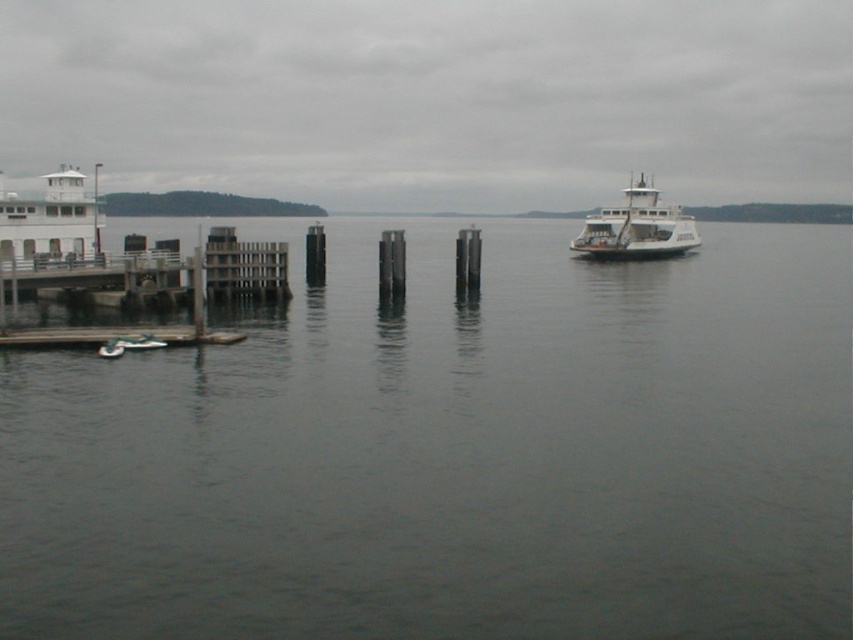
Looking at this image, is gray water at center shorter than white matte ferry at right?

Incorrect, gray water at center's height does not fall short of white matte ferry at right's.

Is gray water at center positioned in front of white matte ferry at right?

That is True.

Who is more forward, (332, 547) or (576, 236)?

Point (332, 547) is in front.

Find the location of a particular element. gray water at center is located at coordinates (454, 452).

Which is in front, point (466, 534) or point (286, 122)?

Positioned in front is point (466, 534).

Does gray water at center have a lesser height compared to white matte ferry at center?

Yes, gray water at center is shorter than white matte ferry at center.

Where is `gray water at center`? This screenshot has height=640, width=853. gray water at center is located at coordinates (454, 452).

In order to click on gray water at center in this screenshot , I will do `click(454, 452)`.

Which is more to the right, white matte ferry at center or white matte ferry at right?

From the viewer's perspective, white matte ferry at right appears more on the right side.

Can you confirm if white matte ferry at center is positioned to the right of white matte ferry at right?

In fact, white matte ferry at center is to the left of white matte ferry at right.

You are a GUI agent. You are given a task and a screenshot of the screen. Output one action in this format:
    pyautogui.click(x=<x>, y=<y>)
    Task: Click on the white matte ferry at center
    The image size is (853, 640).
    Given the screenshot: What is the action you would take?
    pyautogui.click(x=434, y=99)